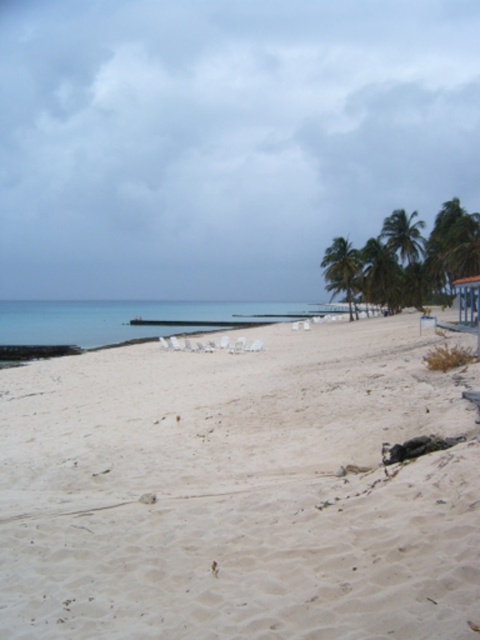
You are standing on the white sandy beach at lower left and want to reach the green leafy palm tree at right. Which direction should you walk to get there?

You should walk upwards from the white sandy beach at lower left towards the green leafy palm tree at right since the white sandy beach is below the palm tree.

You are planning to set up a beach umbrella between the green leafy palm tree at right and the green leafy palm tree at upper right. Based on their sizes, which palm tree would provide more shade for your umbrella setup?

The green leafy palm tree at right is larger in size than the green leafy palm tree at upper right, so it would provide more shade for the umbrella setup.